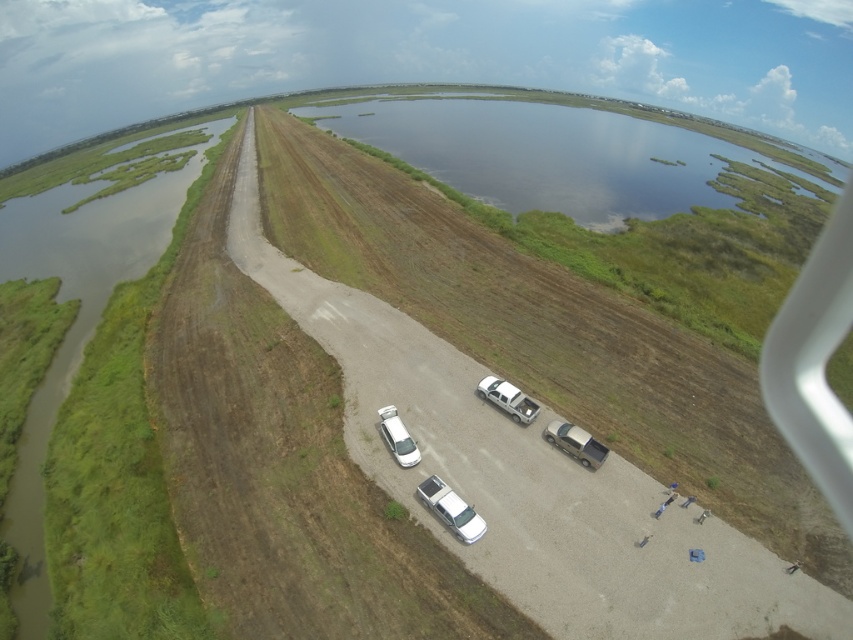
Is green grassy waterway at left positioned at the back of white glossy car at center?

No, it is in front of white glossy car at center.

Does green grassy waterway at left appear on the right side of white glossy car at center?

Incorrect, green grassy waterway at left is not on the right side of white glossy car at center.

You are a GUI agent. You are given a task and a screenshot of the screen. Output one action in this format:
    pyautogui.click(x=<x>, y=<y>)
    Task: Click on the green grassy waterway at left
    This screenshot has height=640, width=853.
    Given the screenshot: What is the action you would take?
    pyautogui.click(x=74, y=321)

Is green grassy waterway at left wider than white glossy truck at center?

Indeed, green grassy waterway at left has a greater width compared to white glossy truck at center.

Describe the element at coordinates (74, 321) in the screenshot. I see `green grassy waterway at left` at that location.

Locate an element on the screen. This screenshot has width=853, height=640. green grassy waterway at left is located at coordinates (74, 321).

Between green grassy waterway at left and white matte truck at center, which one has less height?

white matte truck at center is shorter.

Does green grassy waterway at left have a greater height compared to white matte truck at center?

Correct, green grassy waterway at left is much taller as white matte truck at center.

Is point (91, 237) closer to viewer compared to point (502, 388)?

No, it is behind (502, 388).

Where is `green grassy waterway at left`? The width and height of the screenshot is (853, 640). green grassy waterway at left is located at coordinates (74, 321).